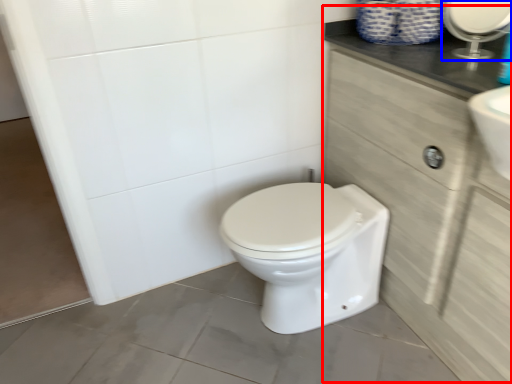
Question: Which object is closer to the camera taking this photo, cabinetry (highlighted by a red box) or mirror (highlighted by a blue box)?

Choices:
 (A) cabinetry
 (B) mirror

Answer: (A)